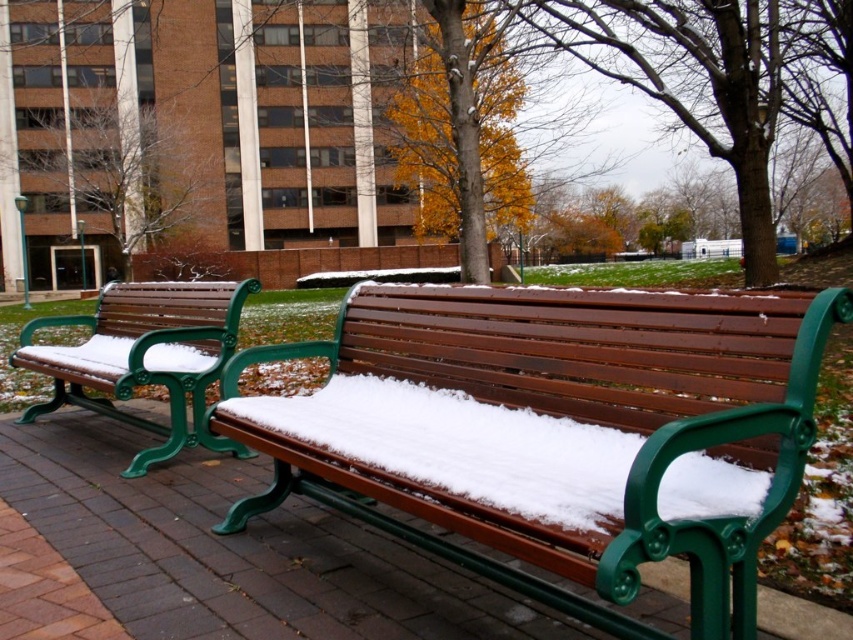
Question: Does matte wood bench at center appear on the left side of white fluffy snow at center?

Choices:
 (A) yes
 (B) no

Answer: (B)

Question: Can you confirm if white fluffy snow at center is smaller than wooden bench at left?

Choices:
 (A) yes
 (B) no

Answer: (A)

Question: Which of the following is the closest to the observer?

Choices:
 (A) matte wood bench at center
 (B) white fluffy snow at center

Answer: (A)

Question: Can you confirm if matte wood bench at center is bigger than white fluffy snow at center?

Choices:
 (A) yes
 (B) no

Answer: (A)

Question: Which point is farther from the camera taking this photo?

Choices:
 (A) (103, 368)
 (B) (674, 492)

Answer: (A)

Question: Which is farther from the wooden bench at left?

Choices:
 (A) white fluffy snow at center
 (B) matte wood bench at center

Answer: (A)